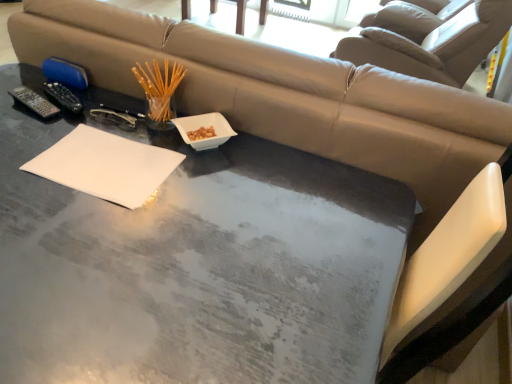
The image size is (512, 384). In order to click on vacant area that lies between black plastic remote at left and white matte notepad at center in this screenshot , I will do `click(57, 135)`.